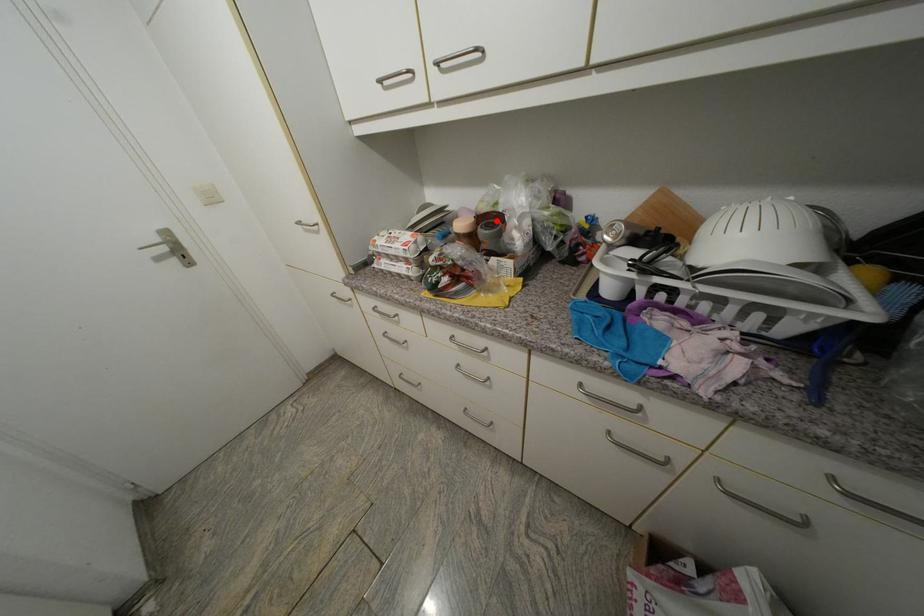
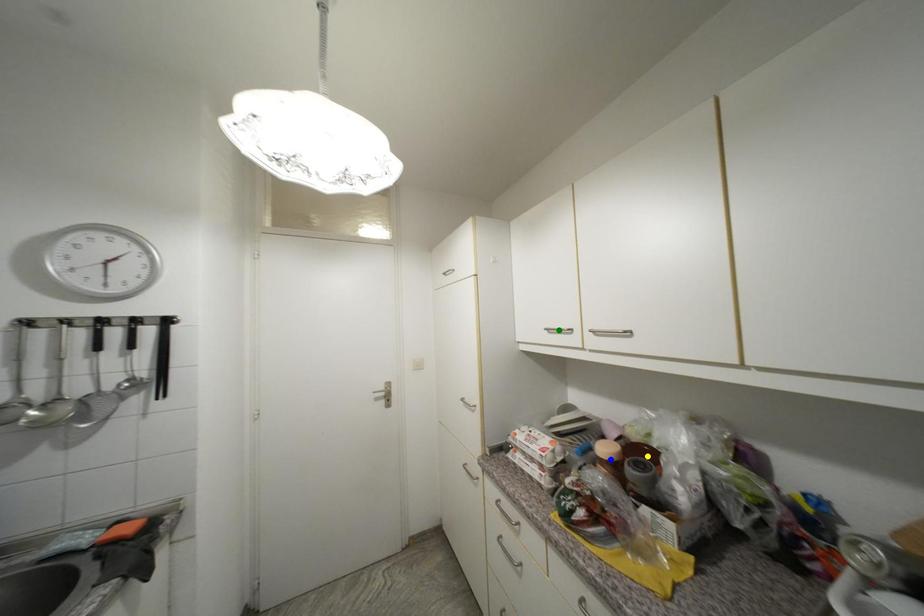
Question: I am providing you with two images of the same scene from different viewpoints. A red point is marked on the first image. You are given multiple points on the second image. Can you choose the point in image 2 that corresponds to the point in image 1?

Choices:
 (A) yellow point
 (B) green point
 (C) blue point

Answer: (A)